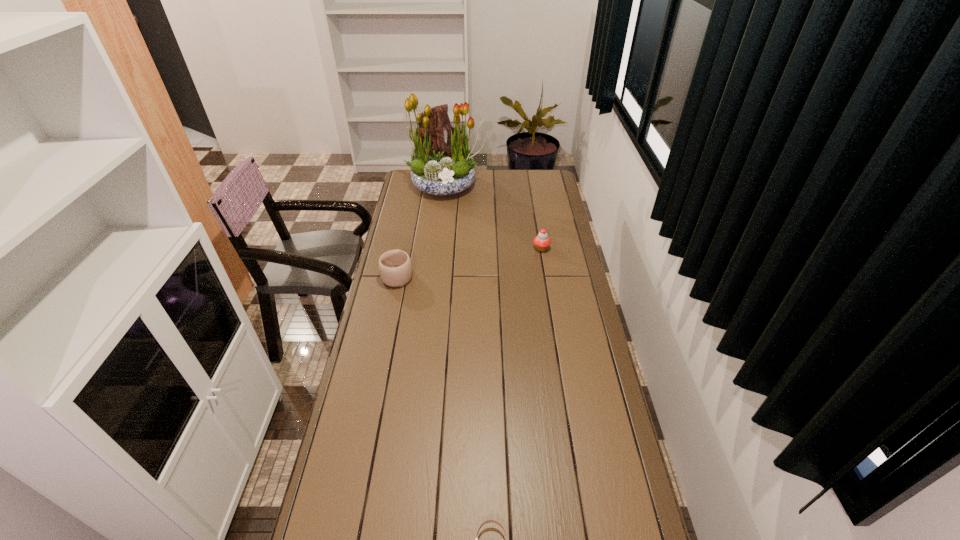
The image size is (960, 540). I want to click on the tallest object, so click(x=438, y=167).

Where is `the farthest object`? the farthest object is located at coordinates (438, 167).

Locate an element on the screen. This screenshot has height=540, width=960. mug is located at coordinates (395, 267).

This screenshot has width=960, height=540. What are the coordinates of `the rightmost object` in the screenshot? It's located at (541, 241).

Where is `the second farthest object`? the second farthest object is located at coordinates (541, 241).

In order to click on blank area located on the front-facing side of the flower arrangement in this screenshot , I will do `click(443, 216)`.

Locate an element on the screen. This screenshot has width=960, height=540. free space located 0.130m on the side of the mug with the handle is located at coordinates (404, 244).

What are the coordinates of `vacant space positioned on the side of the mug with the handle` in the screenshot? It's located at (404, 245).

You are a GUI agent. You are given a task and a screenshot of the screen. Output one action in this format:
    pyautogui.click(x=<x>, y=<y>)
    Task: Click on the blank area located 0.240m on the side of the mug with the handle
    This screenshot has width=960, height=540.
    Given the screenshot: What is the action you would take?
    pyautogui.click(x=407, y=230)

The image size is (960, 540). I want to click on free space located on the back of the rightmost object, so click(537, 222).